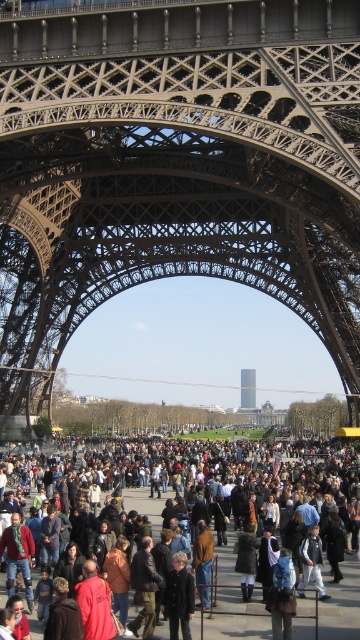
In the scene shown: Can you confirm if dark brown leather coat at center is positioned to the right of smooth glass tower at center?

In fact, dark brown leather coat at center is to the left of smooth glass tower at center.

Between dark brown leather coat at center and smooth glass tower at center, which one has less height?

dark brown leather coat at center

Describe the element at coordinates (178, 596) in the screenshot. I see `dark brown leather coat at center` at that location.

Locate an element on the screen. The height and width of the screenshot is (640, 360). dark brown leather coat at center is located at coordinates (x=178, y=596).

Does point (32, 387) come farther from viewer compared to point (345, 637)?

Yes, it is.

This screenshot has width=360, height=640. What do you see at coordinates (176, 164) in the screenshot?
I see `metallic lattice structure at center` at bounding box center [176, 164].

Locate an element on the screen. metallic lattice structure at center is located at coordinates (176, 164).

Does dark brown leather jacket at lower center appear on the left side of smooth glass tower at center?

Yes, dark brown leather jacket at lower center is to the left of smooth glass tower at center.

You are a GUI agent. You are given a task and a screenshot of the screen. Output one action in this format:
    pyautogui.click(x=<x>, y=<y>)
    Task: Click on the dark brown leather jacket at lower center
    The height and width of the screenshot is (640, 360).
    Given the screenshot: What is the action you would take?
    pyautogui.click(x=141, y=477)

Between point (214, 468) and point (246, 376), which one is positioned in front?

Point (214, 468) is in front.

Identify the location of dark brown leather jacket at lower center. This screenshot has width=360, height=640. (141, 477).